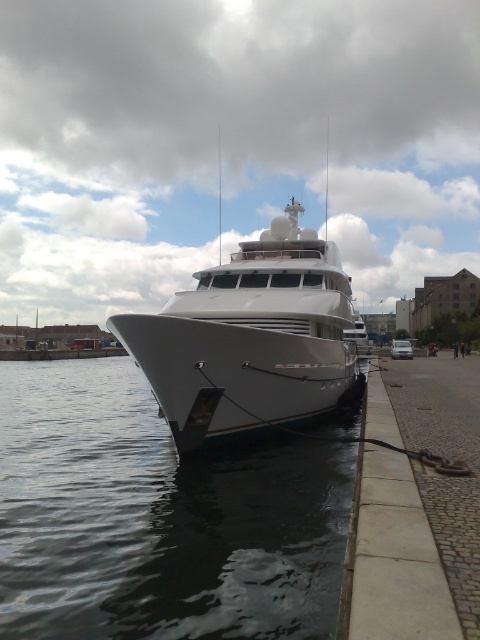
Is clear water at lower left to the left of white glossy yacht at center from the viewer's perspective?

Yes, clear water at lower left is to the left of white glossy yacht at center.

What do you see at coordinates (156, 518) in the screenshot? This screenshot has width=480, height=640. I see `clear water at lower left` at bounding box center [156, 518].

Find the location of a particular element. The width and height of the screenshot is (480, 640). clear water at lower left is located at coordinates (156, 518).